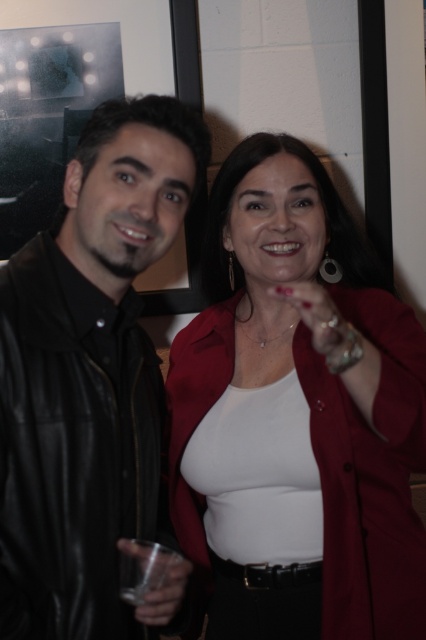
Does black leather jacket at left have a greater height compared to clear plastic cup at lower left?

Yes, black leather jacket at left is taller than clear plastic cup at lower left.

Can you confirm if black leather jacket at left is shorter than clear plastic cup at lower left?

In fact, black leather jacket at left may be taller than clear plastic cup at lower left.

Image resolution: width=426 pixels, height=640 pixels. What do you see at coordinates (89, 378) in the screenshot?
I see `black leather jacket at left` at bounding box center [89, 378].

Where is `black leather jacket at left`? The height and width of the screenshot is (640, 426). black leather jacket at left is located at coordinates point(89,378).

Who is more forward, (x=271, y=312) or (x=152, y=602)?

Point (x=152, y=602) is in front.

Between point (324, 243) and point (175, 582), which one is positioned behind?

The point (324, 243) is behind.

Who is more forward, (411, 380) or (140, 588)?

Point (140, 588) is in front.

Locate an element on the screen. This screenshot has width=426, height=640. matte red blazer at center is located at coordinates (307, 396).

Which is more to the right, matte red blazer at center or black leather jacket at left?

From the viewer's perspective, matte red blazer at center appears more on the right side.

Can you confirm if matte red blazer at center is positioned to the right of black leather jacket at left?

Correct, you'll find matte red blazer at center to the right of black leather jacket at left.

Measure the distance between point (339,282) and camera.

Point (339,282) and camera are 3.78 feet apart from each other.

At what (x,y) coordinates should I click in order to perform the action: click on matte red blazer at center. Please return your answer as a coordinate pair (x, y). Looking at the image, I should click on (307, 396).